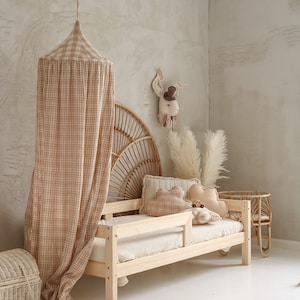
The height and width of the screenshot is (300, 300). Identify the location of pillow. (165, 183), (165, 198), (216, 196).